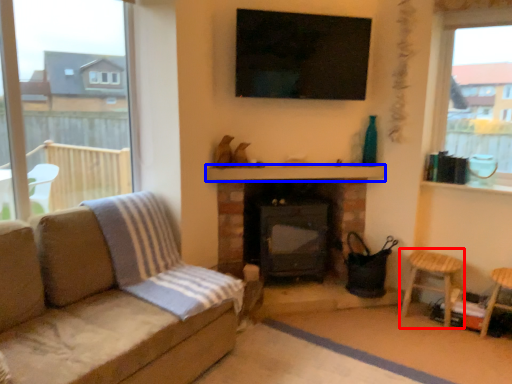
Question: Among these objects, which one is nearest to the camera, bar stool (highlighted by a red box) or balustrade (highlighted by a blue box)?

Choices:
 (A) bar stool
 (B) balustrade

Answer: (A)